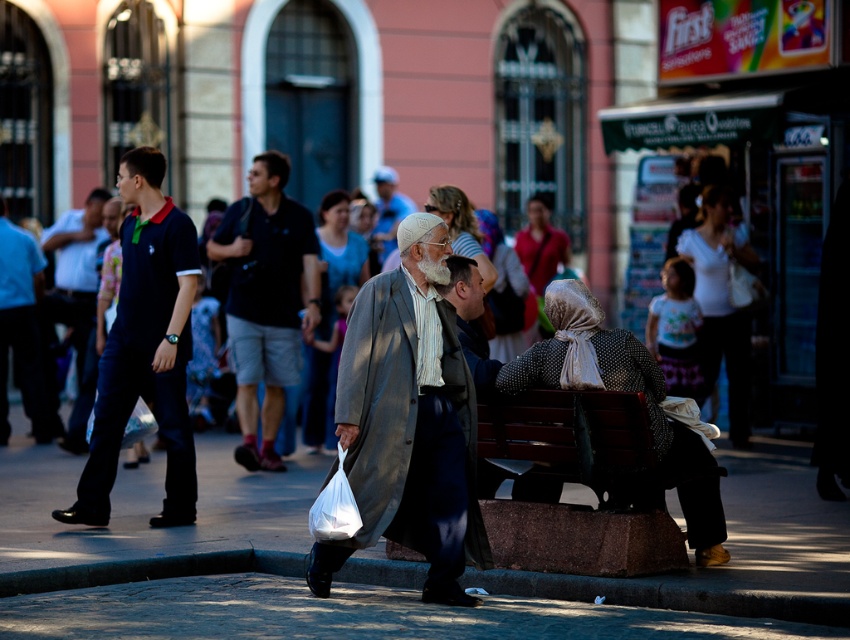
Question: Does white cotton shirt at upper right appear on the right side of dark blue shirt at left?

Choices:
 (A) yes
 (B) no

Answer: (A)

Question: Estimate the real-world distances between objects in this image. Which object is farther from the floral fabric headscarf at upper right?

Choices:
 (A) gray woolen hat at center
 (B) white textured scarf at center
 (C) matte gray coat at center

Answer: (B)

Question: Which point appears farthest from the camera in this image?

Choices:
 (A) click(x=114, y=474)
 (B) click(x=541, y=211)
 (C) click(x=700, y=227)
 (D) click(x=700, y=509)

Answer: (B)

Question: Which object appears closest to the camera in this image?

Choices:
 (A) dark gray coat at center
 (B) wooden bench at lower right

Answer: (B)

Question: Can you confirm if gray wool coat at center is positioned to the left of wooden bench at lower right?

Choices:
 (A) yes
 (B) no

Answer: (A)

Question: Does dark blue shirt at left have a greater width compared to polka dot scarf at center?

Choices:
 (A) no
 (B) yes

Answer: (B)